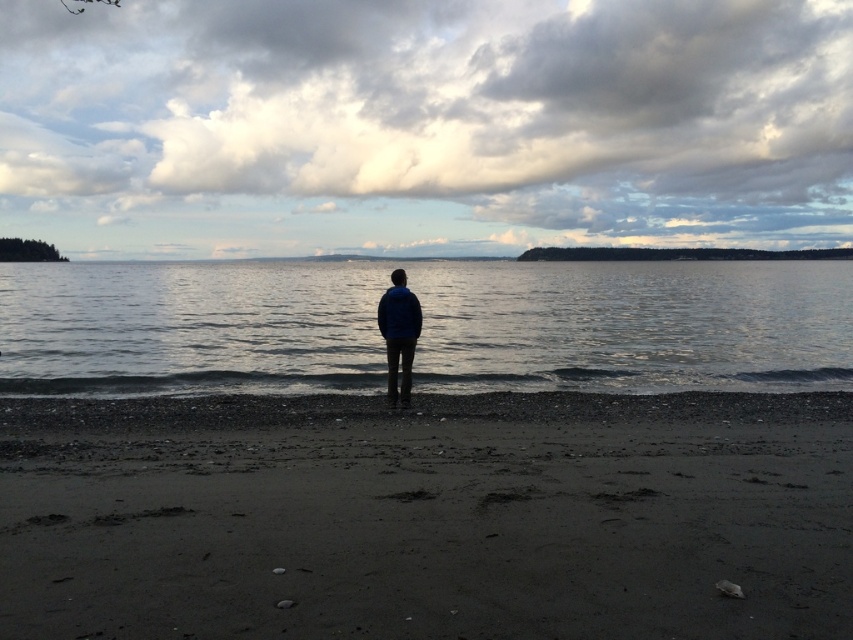
Does clear water at center have a greater height compared to blue matte jacket at center?

Yes.

Between clear water at center and blue matte jacket at center, which one has less height?

Standing shorter between the two is blue matte jacket at center.

Does point (4, 356) come behind point (392, 291)?

Yes.

Identify the location of clear water at center. (633, 324).

Is dark sand at center positioned before blue matte jacket at center?

Yes, it is.

Measure the distance between dark sand at center and camera.

dark sand at center is 4.25 meters away from camera.

Identify the location of dark sand at center. [x=426, y=516].

At what (x,y) coordinates should I click in order to perform the action: click on dark sand at center. Please return your answer as a coordinate pair (x, y). Looking at the image, I should click on (426, 516).

Can you confirm if dark sand at center is shorter than clear water at center?

Correct, dark sand at center is not as tall as clear water at center.

The image size is (853, 640). I want to click on dark sand at center, so click(426, 516).

Identify the location of dark sand at center. (426, 516).